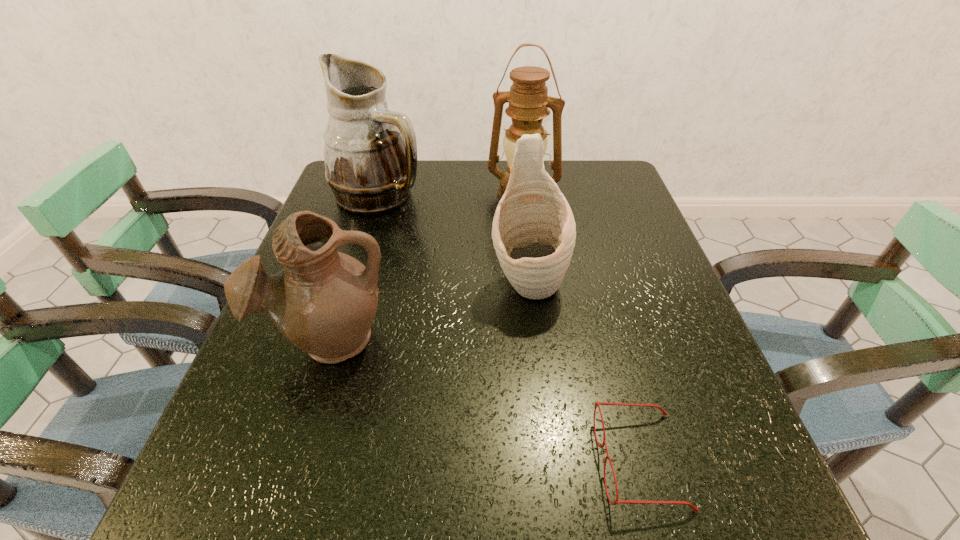
You are a GUI agent. You are given a task and a screenshot of the screen. Output one action in this format:
    pyautogui.click(x=<x>, y=<y>)
    Task: Click on the oil lamp
    
    Given the screenshot: What is the action you would take?
    pyautogui.click(x=528, y=99)

Locate an element on the screen. This screenshot has height=540, width=960. the farthest pitcher is located at coordinates (370, 153).

Find the location of `the rightmost pitcher`. the rightmost pitcher is located at coordinates (533, 231).

Locate an element on the screen. The height and width of the screenshot is (540, 960). the shortest pitcher is located at coordinates (324, 302).

Locate an element on the screen. This screenshot has width=960, height=540. spectacles is located at coordinates [617, 501].

Find the location of `the shortest object`. the shortest object is located at coordinates (617, 501).

Image resolution: width=960 pixels, height=540 pixels. Identify the location of free space located 0.190m on the left of the oil lamp. (418, 194).

This screenshot has height=540, width=960. In order to click on free space located 0.160m from the spout of the farthest pitcher in this screenshot , I will do `click(486, 195)`.

You are a GUI agent. You are given a task and a screenshot of the screen. Output one action in this format:
    pyautogui.click(x=<x>, y=<y>)
    Task: Click on the free region located at the spout of the rightmost pitcher
    
    Given the screenshot: What is the action you would take?
    pyautogui.click(x=542, y=414)

Identify the location of free space located 0.120m at the spout of the fourth tallest object. (296, 445).